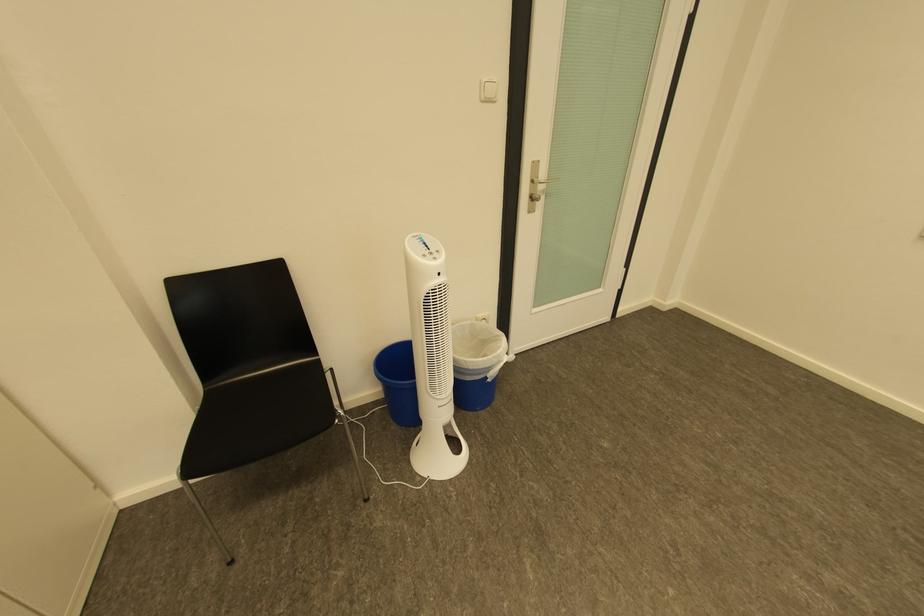
Describe the element at coordinates (488, 90) in the screenshot. The width and height of the screenshot is (924, 616). I see `the light switch` at that location.